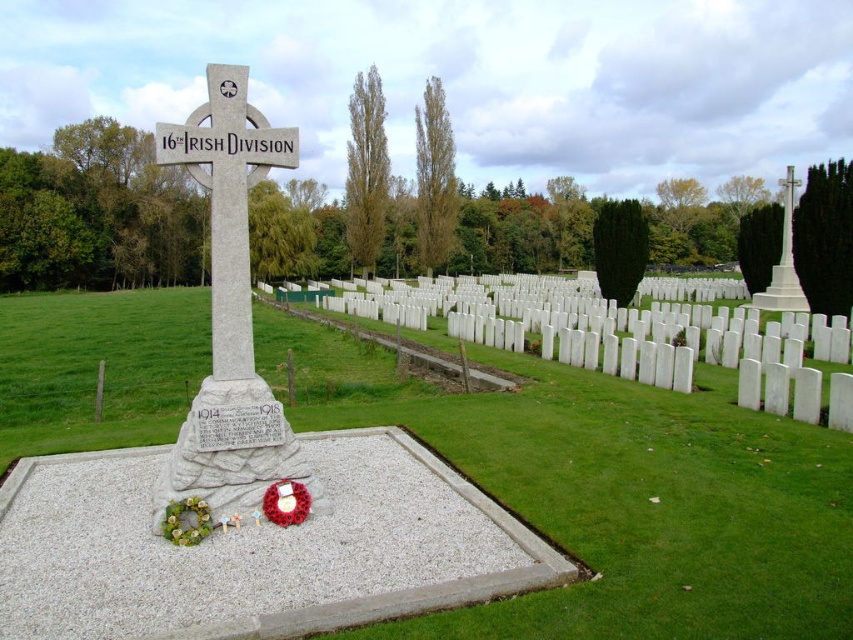
Based on the photo, does white floral wreath at lower left appear over red fabric wreath at center?

No.

Is point (178, 508) less distant than point (274, 492)?

That is True.

Where is `white floral wreath at lower left`? white floral wreath at lower left is located at coordinates (186, 522).

Does point (195, 148) lie in front of point (180, 516)?

No, (195, 148) is behind (180, 516).

Can you confirm if gray stone cross at center is positioned above white floral wreath at lower left?

Correct, gray stone cross at center is located above white floral wreath at lower left.

Which is in front, point (316, 496) or point (192, 502)?

Point (192, 502) is in front.

Image resolution: width=853 pixels, height=640 pixels. I want to click on gray stone cross at center, so pos(229,312).

Which of these two, white stone cross at upper right or white floral wreath at lower left, stands shorter?

Standing shorter between the two is white floral wreath at lower left.

Where is `white stone cross at upper right`? The width and height of the screenshot is (853, 640). white stone cross at upper right is located at coordinates (782, 262).

What do you see at coordinates (782, 262) in the screenshot?
I see `white stone cross at upper right` at bounding box center [782, 262].

Image resolution: width=853 pixels, height=640 pixels. Identify the location of white stone cross at upper right. (x=782, y=262).